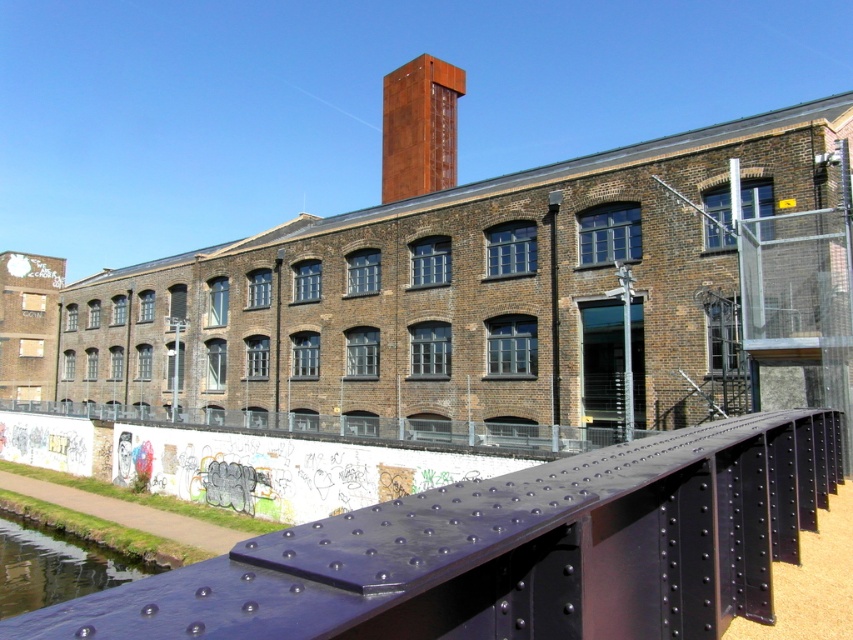
Between smooth steel rail at lower center and clear glass water at lower left, which one has less height?

With less height is clear glass water at lower left.

Does smooth steel rail at lower center have a smaller size compared to clear glass water at lower left?

Actually, smooth steel rail at lower center might be larger than clear glass water at lower left.

Is point (173, 570) less distant than point (28, 522)?

That is True.

Where is `smooth steel rail at lower center`? The width and height of the screenshot is (853, 640). smooth steel rail at lower center is located at coordinates (512, 552).

Is brown brick building at center shorter than smooth steel rail at lower center?

Incorrect, brown brick building at center's height does not fall short of smooth steel rail at lower center's.

Does brown brick building at center have a greater height compared to smooth steel rail at lower center?

Yes, brown brick building at center is taller than smooth steel rail at lower center.

Who is more distant from viewer, (653, 241) or (622, 621)?

The point (653, 241) is behind.

Where is `brown brick building at center`? brown brick building at center is located at coordinates (502, 291).

Is brown brick building at center above clear glass water at lower left?

Yes.

Which is behind, point (711, 314) or point (16, 593)?

Positioned behind is point (711, 314).

Identify the location of brown brick building at center. Image resolution: width=853 pixels, height=640 pixels. (502, 291).